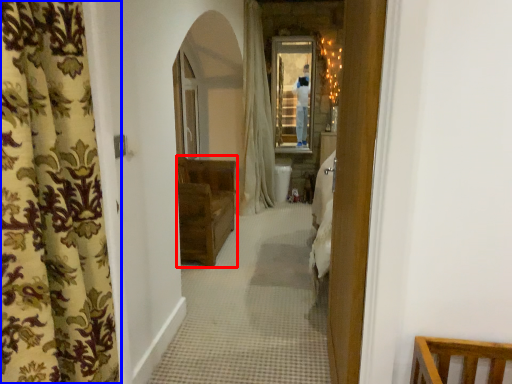
Question: Which object is further to the camera taking this photo, furniture (highlighted by a red box) or curtain (highlighted by a blue box)?

Choices:
 (A) furniture
 (B) curtain

Answer: (A)